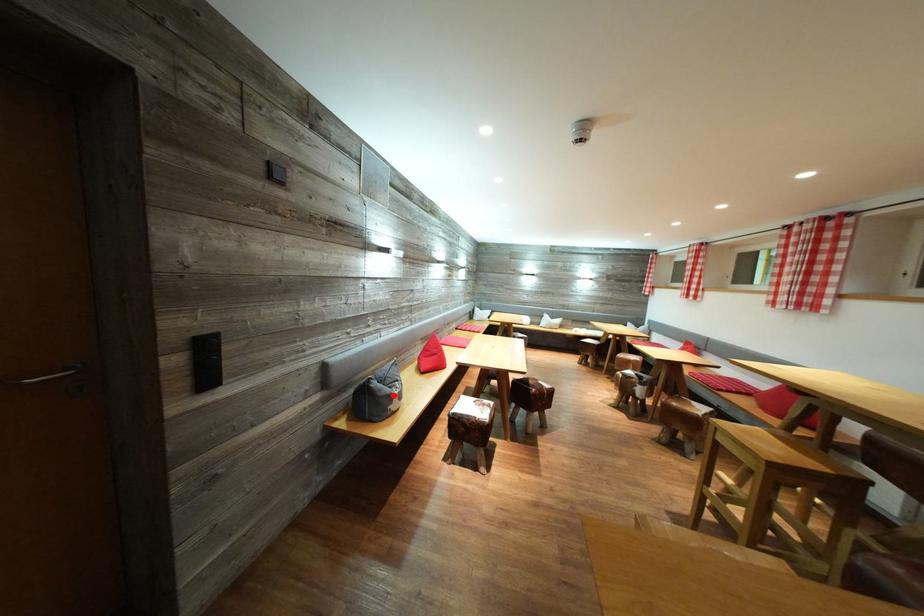
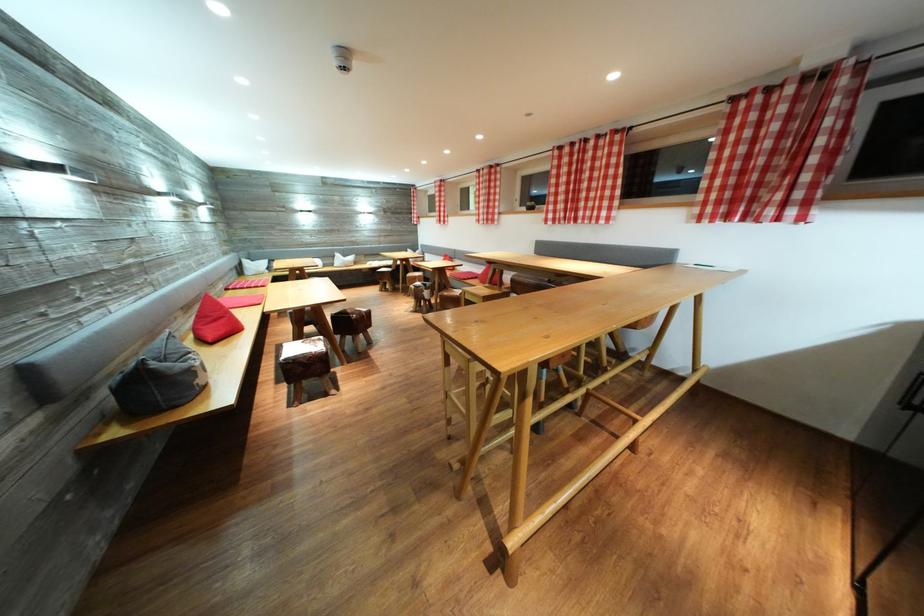
Where in the second image is the point corresponding to the highlighted location from the first image?

(187, 371)